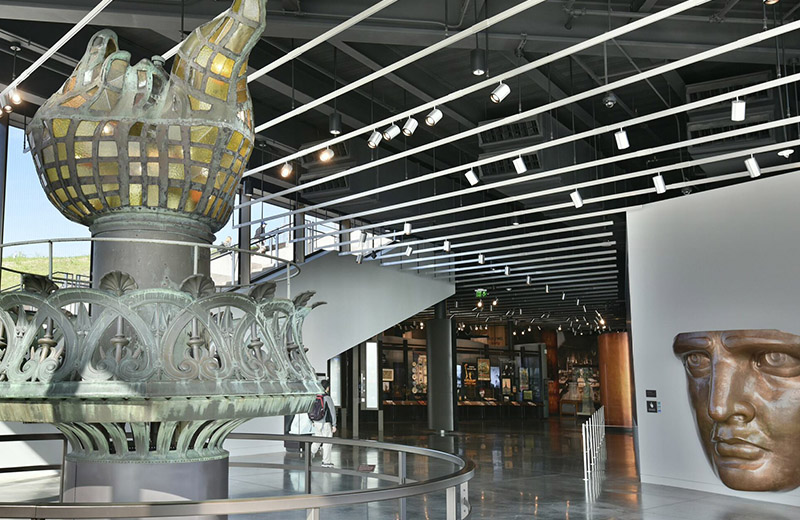
The height and width of the screenshot is (520, 800). I want to click on yellow windows, so 206,138, 226,62, 88,132, 78,104, 82,144, 100,161, 130,169, 150,170.